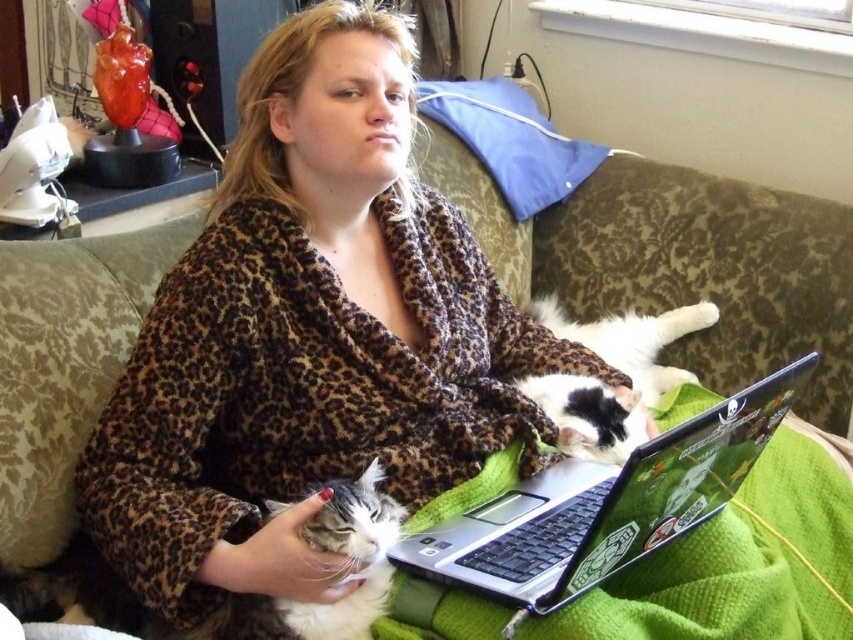
Question: Which point is farther to the camera?

Choices:
 (A) white and black fur cat at center
 (B) white fluffy cat at center
 (C) leopard print robe at center
 (D) silver/black plastic laptop at center

Answer: (A)

Question: Is silver/black plastic laptop at center to the left of white and black fur cat at center from the viewer's perspective?

Choices:
 (A) yes
 (B) no

Answer: (B)

Question: Does silver/black plastic laptop at center have a lesser width compared to white and black fur cat at center?

Choices:
 (A) yes
 (B) no

Answer: (B)

Question: Among these points, which one is nearest to the camera?

Choices:
 (A) (550, 298)
 (B) (610, 412)
 (C) (508, 589)

Answer: (C)

Question: Which object appears closest to the camera in this image?

Choices:
 (A) silver/black plastic laptop at center
 (B) white fur cat at center
 (C) white and black fur cat at center

Answer: (A)

Question: In this image, where is silver/black plastic laptop at center located relative to white fur cat at center?

Choices:
 (A) above
 (B) below

Answer: (B)